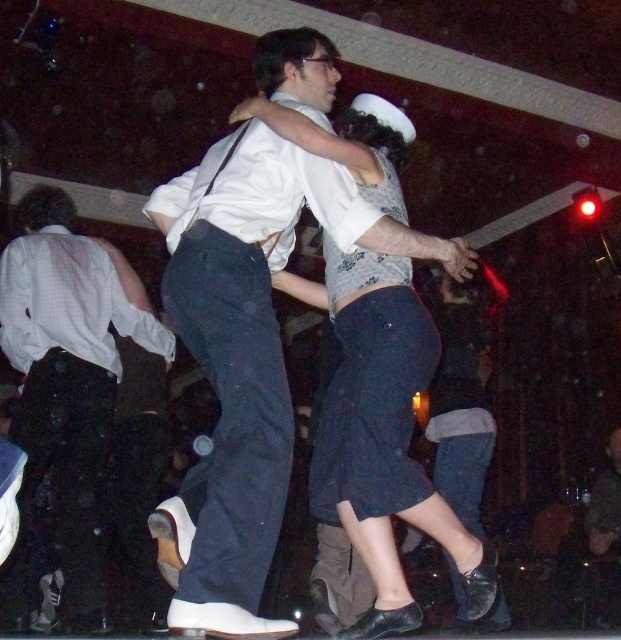
Which is more to the right, white matte shirt at center or matte black pants at center?

white matte shirt at center is more to the right.

This screenshot has height=640, width=621. What are the coordinates of `white matte shirt at center` in the screenshot? It's located at (248, 356).

Does point (193, 227) lie in front of point (75, 394)?

Yes, point (193, 227) is closer to viewer.

Identify the location of white matte shirt at center. (248, 356).